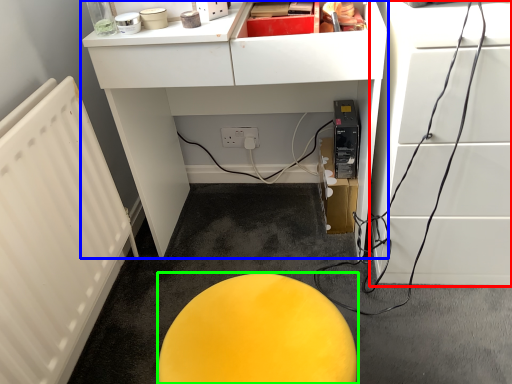
Question: Which object is the farthest from furniture (highlighted by a red box)? Choose among these: furniture (highlighted by a blue box) or furniture (highlighted by a green box).

Choices:
 (A) furniture
 (B) furniture

Answer: (B)